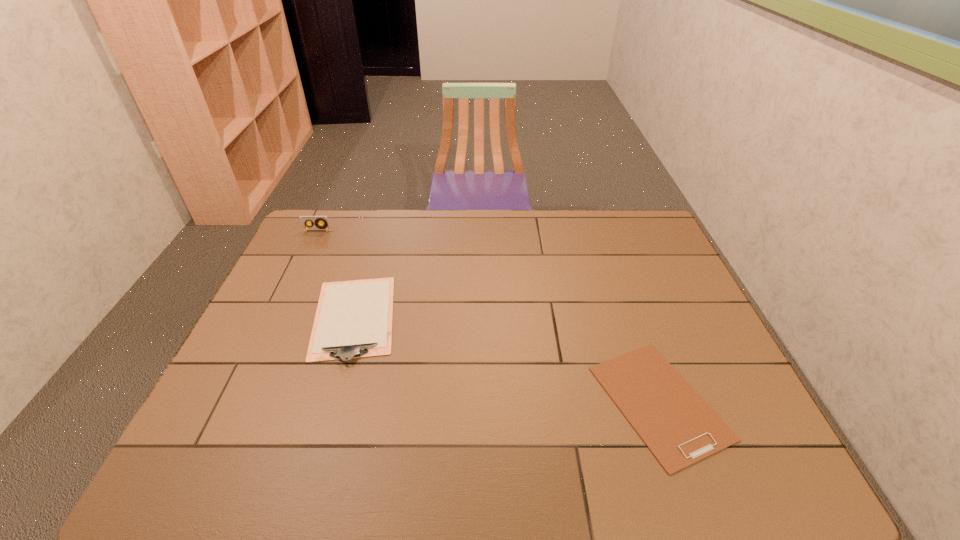
The image size is (960, 540). I want to click on the leftmost object, so click(325, 225).

The width and height of the screenshot is (960, 540). I want to click on the tallest object, so click(325, 225).

You are a GUI agent. You are given a task and a screenshot of the screen. Output one action in this format:
    pyautogui.click(x=<x>, y=<y>)
    Task: Click on the taller clipboard
    Image resolution: width=960 pixels, height=540 pixels.
    Given the screenshot: What is the action you would take?
    pyautogui.click(x=353, y=319)

Locate an element on the screen. This screenshot has height=540, width=960. the left clipboard is located at coordinates (353, 319).

Identify the location of the right clipboard. (676, 424).

The height and width of the screenshot is (540, 960). In order to click on the rightmost object in this screenshot , I will do `click(676, 424)`.

In order to click on vacant space located at the front of the farthest object with visible reels in this screenshot , I will do `click(292, 284)`.

Where is `blank space located 0.100m on the right of the second shortest object`? blank space located 0.100m on the right of the second shortest object is located at coordinates (433, 318).

Find the location of a particular element. The height and width of the screenshot is (540, 960). vacant region located 0.340m on the left of the right clipboard is located at coordinates (454, 402).

Identify the location of object positioned at the far edge. tap(325, 225).